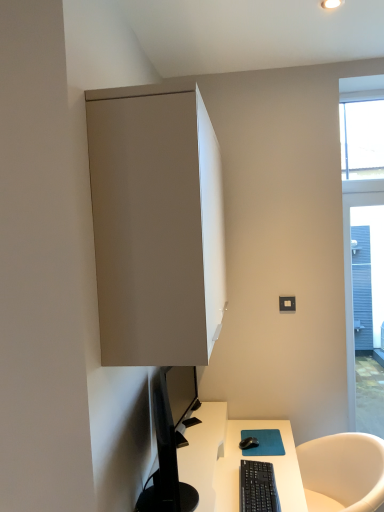
Measure the distance between black plastic keyboard at lower center and camera.

black plastic keyboard at lower center is 1.54 meters from camera.

The width and height of the screenshot is (384, 512). Describe the element at coordinates (156, 225) in the screenshot. I see `matte gray cabinet at upper left` at that location.

What is the approximate height of black matte mouse at lower center?

1.24 inches.

Describe the element at coordinates (248, 443) in the screenshot. The image size is (384, 512). I see `black matte mouse at lower center` at that location.

Locate an element on the screen. The height and width of the screenshot is (512, 384). black glossy monitor at lower left is located at coordinates (166, 460).

What are the coordinates of `black plastic keyboard at lower center` in the screenshot? It's located at (x=258, y=487).

From a real-world perspective, is white glossy desk at lower center positioned under clear glass window at upper right based on gravity?

Yes, from a real-world perspective, white glossy desk at lower center is under clear glass window at upper right.

Is white glossy desk at lower center bigger or smaller than clear glass window at upper right?

white glossy desk at lower center is bigger than clear glass window at upper right.

Consider the image. Is white glossy desk at lower center taller than clear glass window at upper right?

Incorrect, the height of white glossy desk at lower center is not larger of that of clear glass window at upper right.

Visually, is black glossy monitor at lower left positioned to the left or to the right of clear glass window at upper right?

In the image, black glossy monitor at lower left appears on the left side of clear glass window at upper right.

Is black glossy monitor at lower left facing towards clear glass window at upper right?

Yes, black glossy monitor at lower left is aimed at clear glass window at upper right.

Measure the distance from black glossy monitor at lower left to clear glass window at upper right.

black glossy monitor at lower left is 5.37 feet away from clear glass window at upper right.

From a real-world perspective, which is physically below, black glossy monitor at lower left or clear glass window at upper right?

black glossy monitor at lower left, from a real-world perspective.

From a real-world perspective, between black glossy monitor at lower left and black matte mouse at lower center, who is vertically lower?

black matte mouse at lower center is physically lower.

In the image, is black glossy monitor at lower left positioned in front of or behind black matte mouse at lower center?

Visually, black glossy monitor at lower left is located in front of black matte mouse at lower center.

Does black glossy monitor at lower left have a smaller size compared to black matte mouse at lower center?

No.

Is clear glass window at upper right positioned behind white glossy desk at lower center?

Yes, clear glass window at upper right is further from the camera.

From a real-world perspective, is clear glass window at upper right on white glossy desk at lower center?

Correct, in the physical world, clear glass window at upper right is higher than white glossy desk at lower center.

Does clear glass window at upper right have a greater height compared to white glossy desk at lower center?

Correct, clear glass window at upper right is much taller as white glossy desk at lower center.

This screenshot has width=384, height=512. I want to click on window on the right of white glossy desk at lower center, so click(x=364, y=246).

From a real-world perspective, relative to black glossy monitor at lower left, is matte gray cabinet at upper left vertically above or below?

matte gray cabinet at upper left is situated higher than black glossy monitor at lower left in the real world.

Measure the distance from matte gray cabinet at upper left to black glossy monitor at lower left.

matte gray cabinet at upper left is 20.61 inches from black glossy monitor at lower left.

Considering the sizes of matte gray cabinet at upper left and black glossy monitor at lower left in the image, is matte gray cabinet at upper left taller or shorter than black glossy monitor at lower left?

matte gray cabinet at upper left is taller than black glossy monitor at lower left.

From the image's perspective, which one is positioned lower, matte gray cabinet at upper left or black glossy monitor at lower left?

black glossy monitor at lower left appears lower in the image.

From a real-world perspective, is clear glass window at upper right physically located above or below matte gray cabinet at upper left?

Clearly, from a real-world perspective, clear glass window at upper right is below matte gray cabinet at upper left.

Visually, is clear glass window at upper right positioned to the left or to the right of matte gray cabinet at upper left?

From the image, it's evident that clear glass window at upper right is to the right of matte gray cabinet at upper left.

Are clear glass window at upper right and matte gray cabinet at upper left located far from each other?

Yes.

How many degrees apart are the facing directions of clear glass window at upper right and matte gray cabinet at upper left?

The facing directions of clear glass window at upper right and matte gray cabinet at upper left are 88 degrees apart.

Find the location of a particular element. The width and height of the screenshot is (384, 512). desk located below the black plastic keyboard at lower center (from the image's perspective) is located at coordinates (234, 460).

Considering the relative sizes of black plastic keyboard at lower center and white glossy desk at lower center in the image provided, is black plastic keyboard at lower center bigger than white glossy desk at lower center?

Actually, black plastic keyboard at lower center might be smaller than white glossy desk at lower center.

Is black plastic keyboard at lower center facing away from white glossy desk at lower center?

Yes, black plastic keyboard at lower center is facing away from white glossy desk at lower center.

This screenshot has height=512, width=384. I want to click on desk that is below the clear glass window at upper right (from the image's perspective), so click(234, 460).

Find the location of a particular element. This screenshot has width=384, height=512. computer monitor lying on the left of clear glass window at upper right is located at coordinates (166, 460).

Consider the image. From the image, which object appears to be nearer to black matte mouse at lower center, clear glass window at upper right or matte gray cabinet at upper left?

The object closer to black matte mouse at lower center is matte gray cabinet at upper left.

In the scene shown: From the image, which object appears to be nearer to matte gray cabinet at upper left, clear glass window at upper right or black glossy monitor at lower left?

black glossy monitor at lower left is closer to matte gray cabinet at upper left.

Estimate the real-world distances between objects in this image. Which object is closer to black matte mouse at lower center, matte gray cabinet at upper left or black plastic keyboard at lower center?

black plastic keyboard at lower center is positioned closer to the anchor black matte mouse at lower center.

Looking at the image, which one is located further to black glossy monitor at lower left, matte gray cabinet at upper left or white glossy desk at lower center?

matte gray cabinet at upper left lies further to black glossy monitor at lower left than the other object.

Considering their positions, is black matte mouse at lower center positioned closer to clear glass window at upper right than white glossy desk at lower center?

Based on the image, white glossy desk at lower center appears to be nearer to clear glass window at upper right.

Which object lies further to the anchor point clear glass window at upper right, black matte mouse at lower center or black plastic keyboard at lower center?

black matte mouse at lower center is further to clear glass window at upper right.

Based on their spatial positions, is black plastic keyboard at lower center or clear glass window at upper right further from white glossy desk at lower center?

clear glass window at upper right is further to white glossy desk at lower center.

When comparing their distances from matte gray cabinet at upper left, does clear glass window at upper right or black plastic keyboard at lower center seem further?

clear glass window at upper right is further to matte gray cabinet at upper left.

Locate an element on the screen. mouse located between white glossy desk at lower center and clear glass window at upper right in the depth direction is located at coordinates (248, 443).

This screenshot has width=384, height=512. Find the location of `computer keyboard between black glossy monitor at lower left and black matte mouse at lower center along the z-axis`. computer keyboard between black glossy monitor at lower left and black matte mouse at lower center along the z-axis is located at coordinates (258, 487).

At what (x,y) coordinates should I click in order to perform the action: click on computer keyboard between white glossy desk at lower center and black matte mouse at lower center from front to back. Please return your answer as a coordinate pair (x, y). This screenshot has width=384, height=512. Looking at the image, I should click on (258, 487).

Locate an element on the screen. This screenshot has width=384, height=512. computer keyboard between matte gray cabinet at upper left and white glossy desk at lower center in the vertical direction is located at coordinates (258, 487).